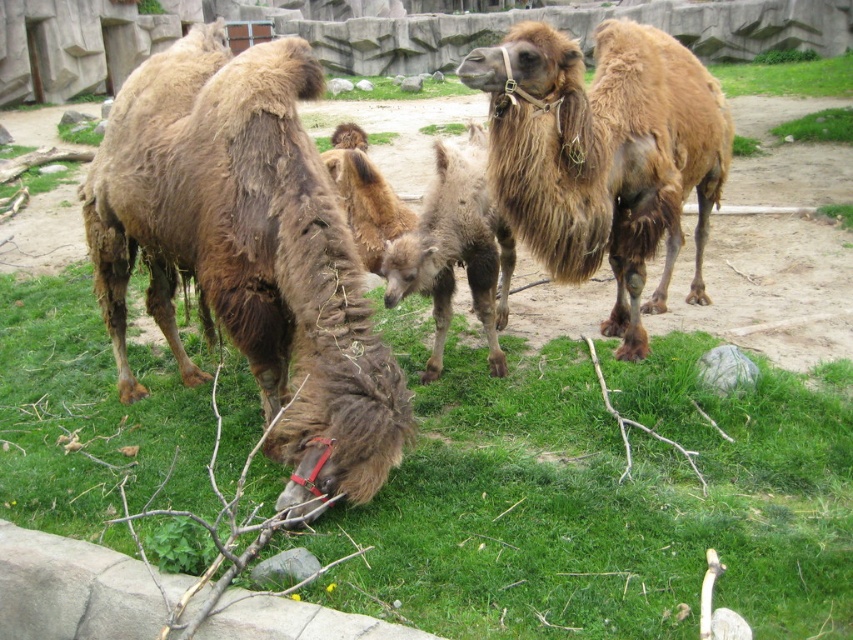
You are a zookeeper planning to mow the green grass at lower left and the brown fuzzy camel at upper right. Since you need to know which area requires more time, can you determine which is wider?

The green grass at lower left is wider than the brown fuzzy camel at upper right, so it will require more time to mow.

You are a zookeeper planning to mow the grass in the enclosure. The lawnmower you have can only cut grass shorter than the fuzzy brown camel at center. Will the green grass at lower left be cut by the lawnmower?

The green grass at lower left is shorter than the fuzzy brown camel at center, so the lawnmower can cut it since it meets the requirement of being shorter than the camel.